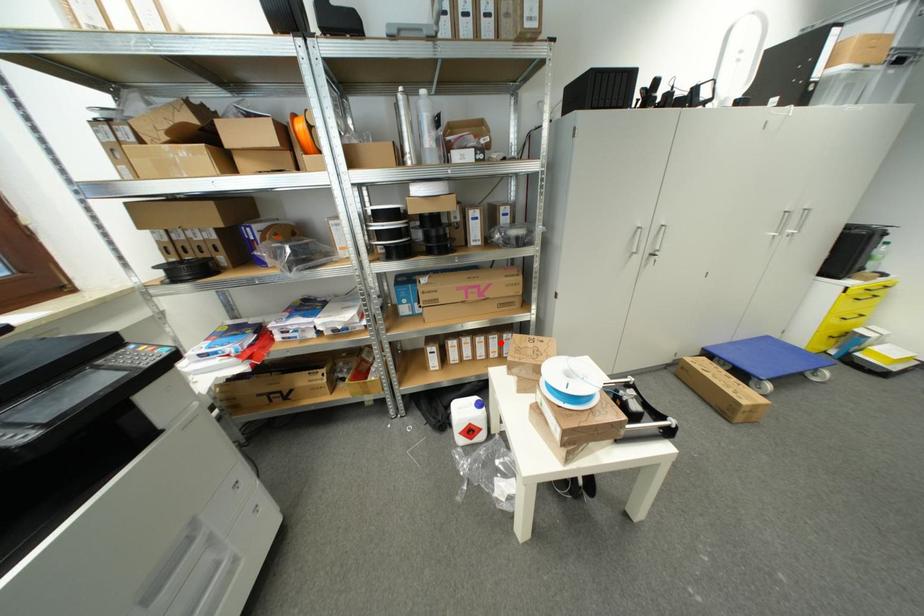
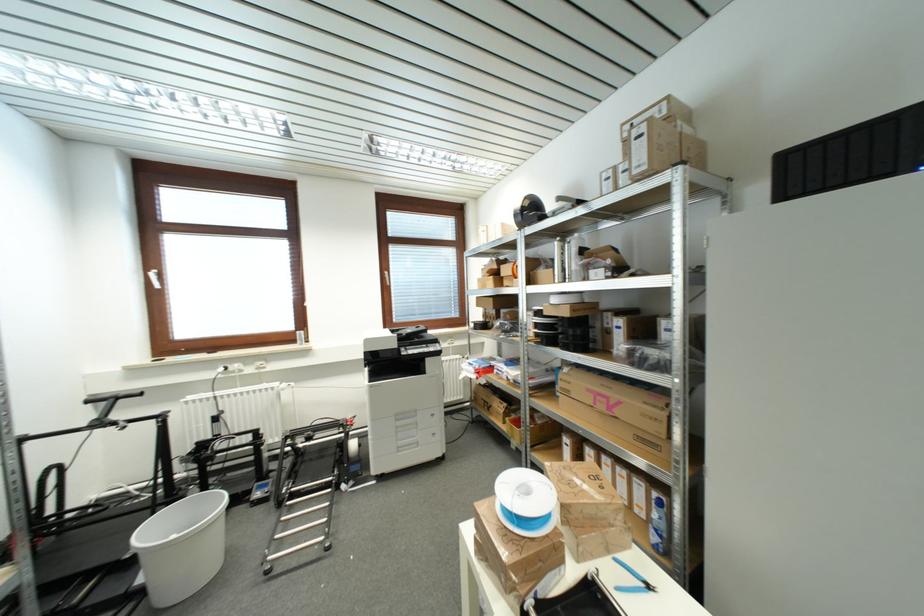
In the second image, find the point that corresponds to the highlighted location in the first image.

(648, 493)